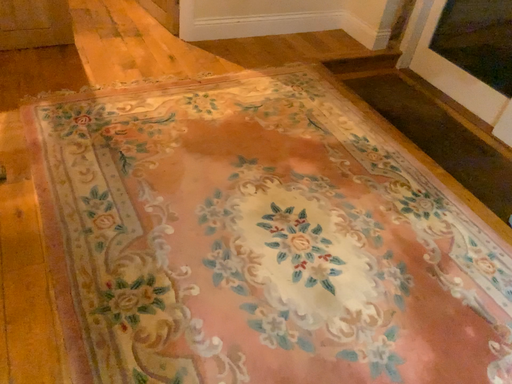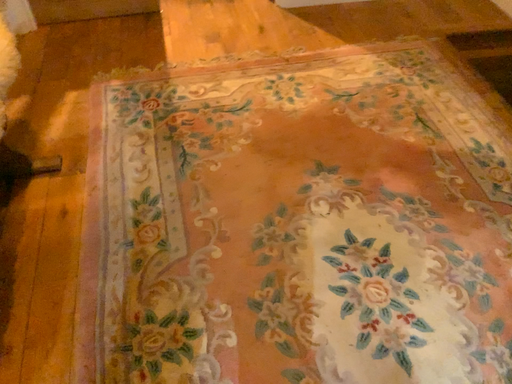
Question: How did the camera likely rotate when shooting the video?

Choices:
 (A) rotated right
 (B) rotated left

Answer: (B)